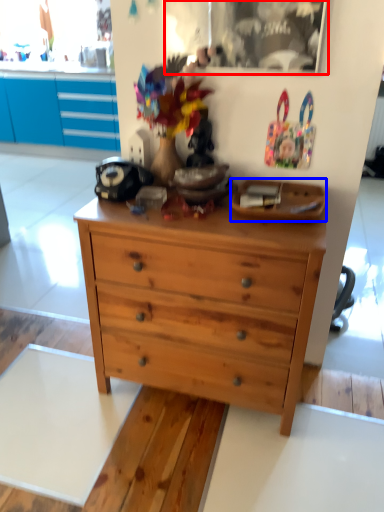
Question: Which object appears farthest to the camera in this image, picture frame (highlighted by a red box) or plate (highlighted by a blue box)?

Choices:
 (A) picture frame
 (B) plate

Answer: (A)